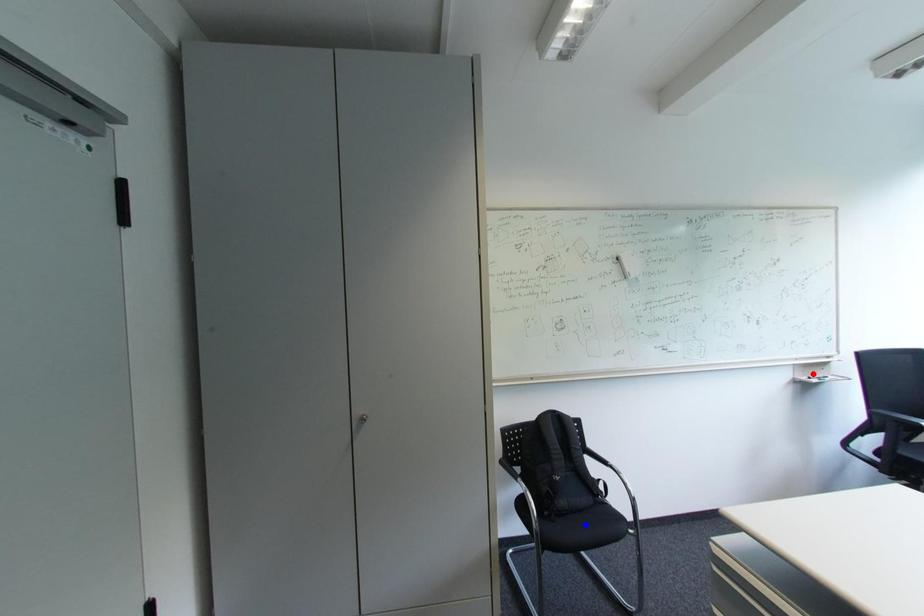
Question: Two points are marked on the image. Which point is closer to the camera?

Choices:
 (A) Blue point is closer.
 (B) Red point is closer.

Answer: (A)